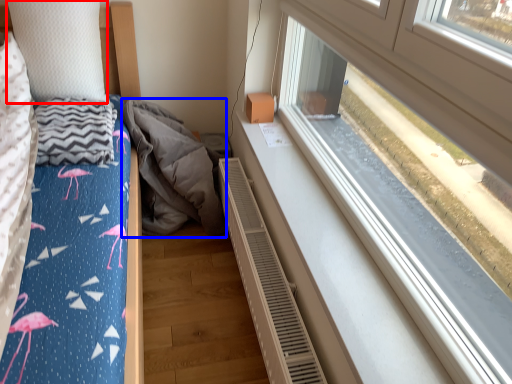
Question: Which object appears closest to the camera in this image, pillow (highlighted by a red box) or material (highlighted by a blue box)?

Choices:
 (A) pillow
 (B) material

Answer: (A)